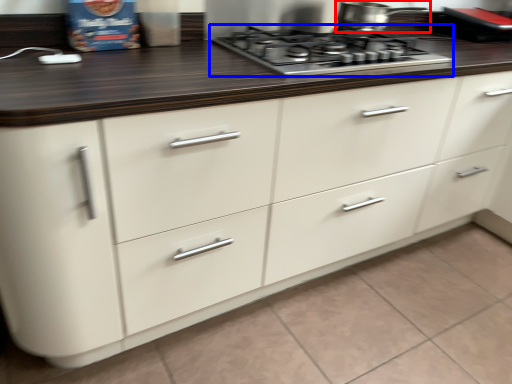
Question: Which of the following is the farthest to the observer, kitchen appliance (highlighted by a red box) or gas stove (highlighted by a blue box)?

Choices:
 (A) kitchen appliance
 (B) gas stove

Answer: (A)